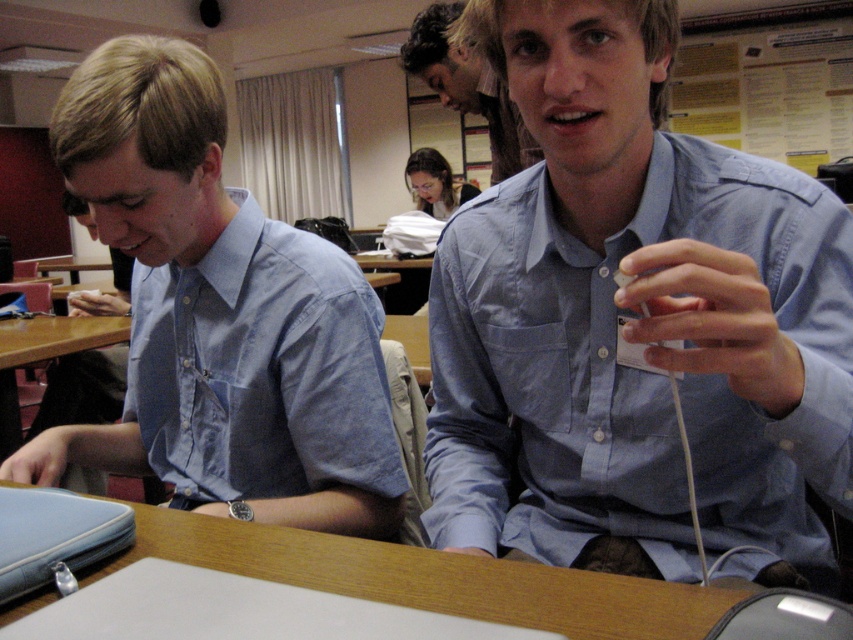
Does blue shirt at left have a greater width compared to matte black hair at upper center?

Yes.

Is point (51, 125) more distant than point (450, 209)?

No, it is not.

Identify the location of blue shirt at left. (219, 316).

Does point (534, 144) come behind point (427, 179)?

No, it is not.

Does point (422, 44) come behind point (445, 188)?

No, (422, 44) is in front of (445, 188).

Identify the location of blue shirt at upper center. (468, 86).

Is blue shirt at center thinner than blue shirt at left?

Yes.

Is blue shirt at center bigger than blue shirt at left?

Indeed, blue shirt at center has a larger size compared to blue shirt at left.

Is point (769, 492) closer to camera compared to point (258, 212)?

Yes, point (769, 492) is closer to viewer.

Locate an element on the screen. Image resolution: width=853 pixels, height=640 pixels. blue shirt at center is located at coordinates (635, 324).